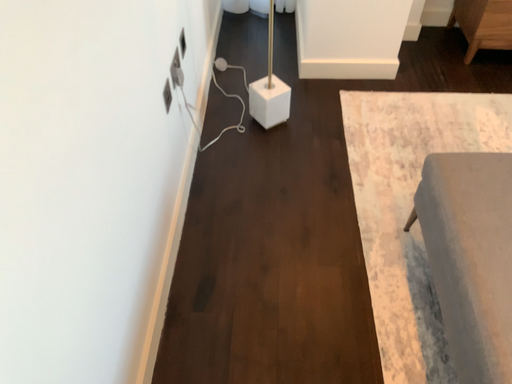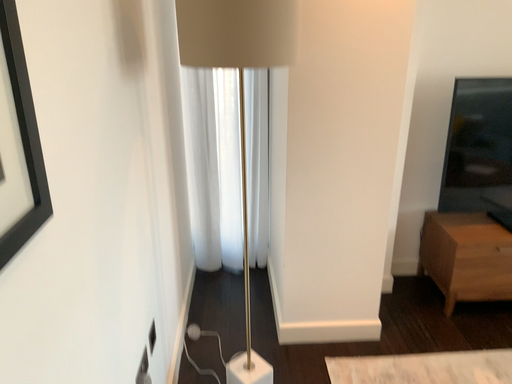
Question: Which way did the camera rotate in the video?

Choices:
 (A) rotated downward
 (B) rotated upward

Answer: (B)